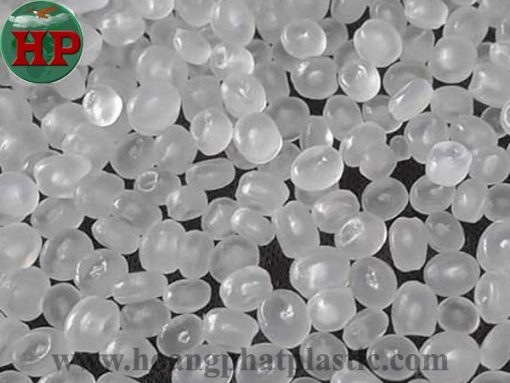
I want to click on corner, so click(406, 168), click(502, 9).